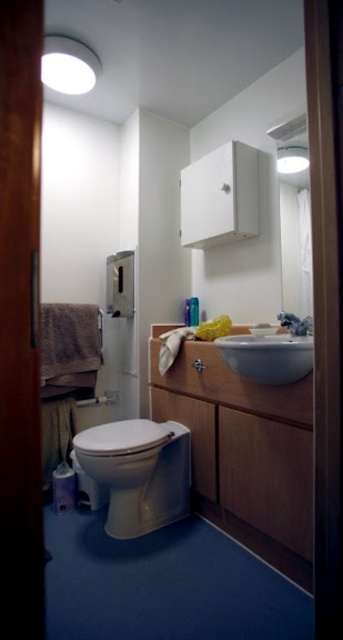
You are a plumber inspecting the bathroom and need to replace the satin silver faucet at sink right. Given that the white glossy sink at center is larger, will you need to adjust the placement of the faucet during installation?

The white glossy sink at center is larger than the satin silver faucet at sink right, so the plumber will need to ensure the new faucet fits within the sink dimensions during installation.